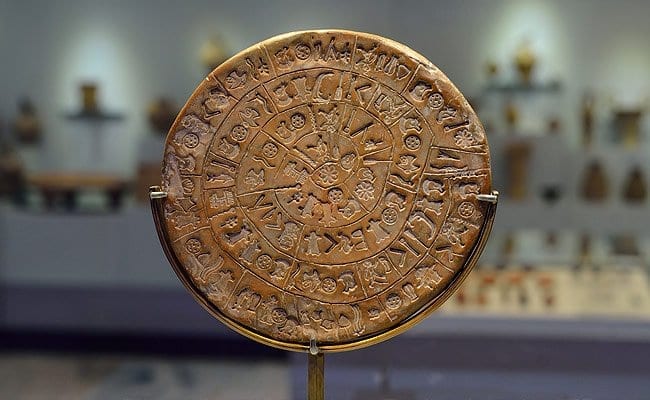
The height and width of the screenshot is (400, 650). I want to click on art objects, so click(x=595, y=197), click(x=624, y=135), click(x=587, y=123), click(x=526, y=63), click(x=511, y=113), click(x=513, y=167), click(x=157, y=112), click(x=83, y=97), click(x=29, y=115).